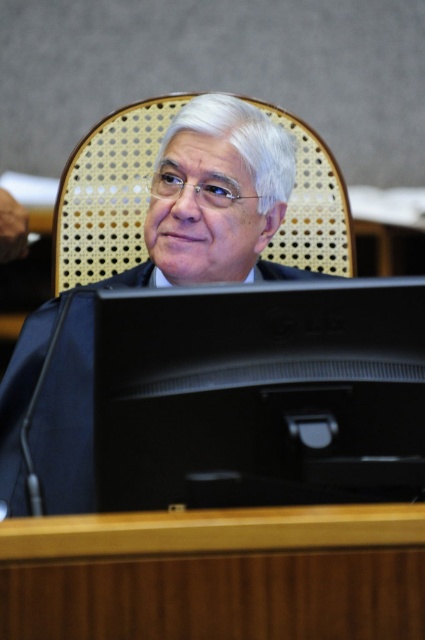
You are a photographer standing in front of the man in the image. You want to take a closeup shot of his face without including the black matte suit at center in the frame. Based on the distance provided, is this possible?

The black matte suit at center is 37.70 inches away from the viewer. Since the suit is positioned at center, it is likely blocking the direct line of sight to the man s face. To capture a closeup of his face without the suit, you would need to adjust your angle or move closer, but given the fixed distance, it might not be possible without cropping the image.

In the image of a formal setting, where exactly is the black matte suit at center positioned in terms of coordinates?

The black matte suit at center is positioned at coordinates point (144, 285).

You are an assistant in a courtroom. You need to place a legal document on the wooden table at center so it is directly to the left of the black glossy monitor at center. Is this possible given their positions?

The black glossy monitor at center is to the right of the wooden table at center. Therefore, placing the legal document on the wooden table at center directly to the left of the black glossy monitor at center is possible since the monitor is already positioned to the right of the table.